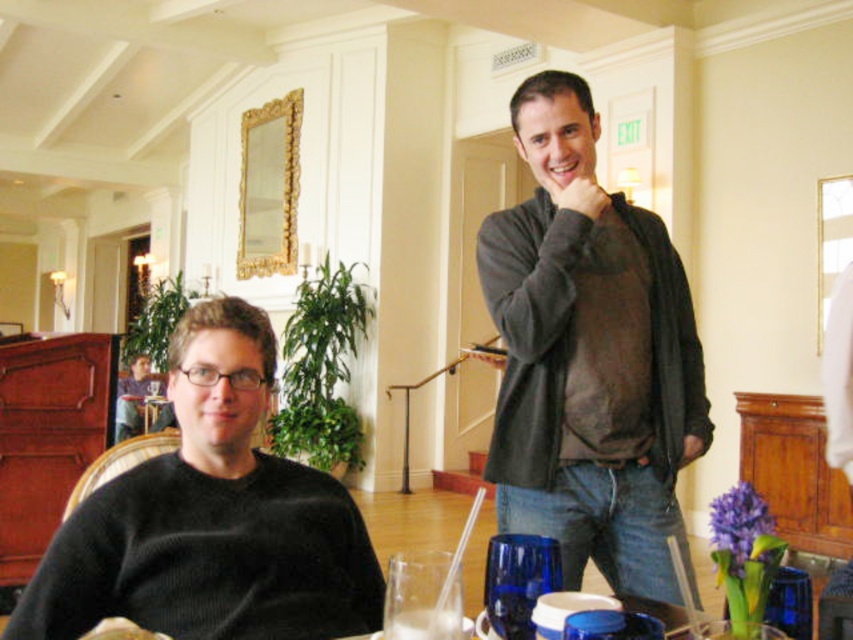
Can you confirm if black matte sweater at left is taller than white matte bread at lower left?

Yes.

Can you confirm if black matte sweater at left is positioned to the left of white matte bread at lower left?

In fact, black matte sweater at left is to the right of white matte bread at lower left.

You are a GUI agent. You are given a task and a screenshot of the screen. Output one action in this format:
    pyautogui.click(x=<x>, y=<y>)
    Task: Click on the black matte sweater at left
    The width and height of the screenshot is (853, 640).
    Given the screenshot: What is the action you would take?
    pyautogui.click(x=212, y=518)

Can you confirm if dark gray sweater at upper right is smaller than black matte sweater at left?

No.

Between point (552, 513) and point (352, 516), which one is positioned in front?

Point (352, 516)

What do you see at coordinates (589, 356) in the screenshot?
I see `dark gray sweater at upper right` at bounding box center [589, 356].

At what (x,y) coordinates should I click in order to perform the action: click on dark gray sweater at upper right. Please return your answer as a coordinate pair (x, y). The width and height of the screenshot is (853, 640). Looking at the image, I should click on (589, 356).

Who is higher up, dark gray sweater at upper right or white matte bread at lower left?

dark gray sweater at upper right

Does dark gray sweater at upper right have a greater width compared to white matte bread at lower left?

Correct, the width of dark gray sweater at upper right exceeds that of white matte bread at lower left.

What do you see at coordinates (589, 356) in the screenshot? I see `dark gray sweater at upper right` at bounding box center [589, 356].

Locate an element on the screen. Image resolution: width=853 pixels, height=640 pixels. dark gray sweater at upper right is located at coordinates (589, 356).